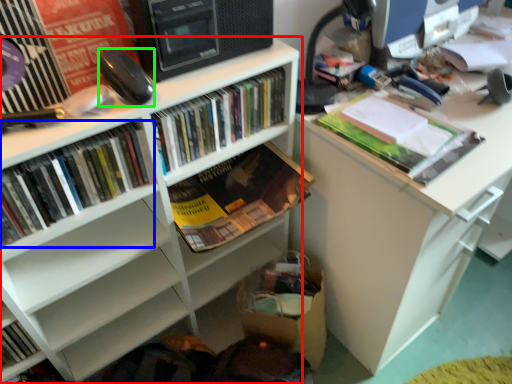
Question: Which is nearer to the bookcase (highlighted by a red box)? book (highlighted by a blue box) or equipment (highlighted by a green box).

Choices:
 (A) book
 (B) equipment

Answer: (A)